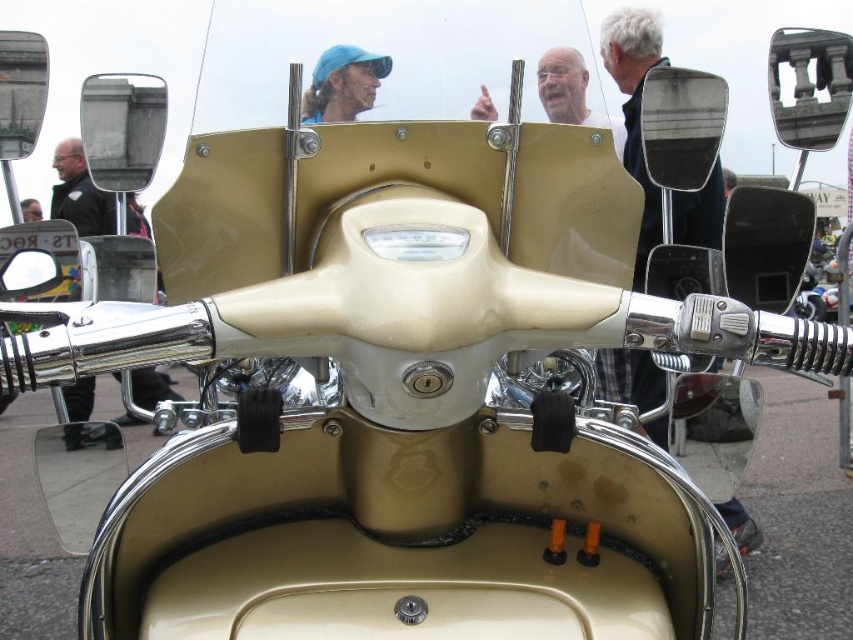
Who is lower down, gray hair at upper left or matte blue cap at upper center?

Positioned lower is matte blue cap at upper center.

This screenshot has height=640, width=853. I want to click on gray hair at upper left, so click(635, 109).

This screenshot has height=640, width=853. Identify the location of gray hair at upper left. click(635, 109).

Locate an element on the screen. The image size is (853, 640). smooth beige scooter at center is located at coordinates (572, 93).

Which of these two, smooth beige scooter at center or matte black helmet at upper left, stands taller?

smooth beige scooter at center is taller.

At what (x,y) coordinates should I click in order to perform the action: click on smooth beige scooter at center. Please return your answer as a coordinate pair (x, y). The width and height of the screenshot is (853, 640). Looking at the image, I should click on (572, 93).

Find the location of `smooth beige scooter at center`. smooth beige scooter at center is located at coordinates (572, 93).

Looking at this image, does matte blue cap at upper center have a lesser height compared to matte black helmet at upper left?

In fact, matte blue cap at upper center may be taller than matte black helmet at upper left.

Between matte blue cap at upper center and matte black helmet at upper left, which one has less height?

matte black helmet at upper left

Which is behind, point (329, 113) or point (28, 204)?

Positioned behind is point (28, 204).

Where is `matte blue cap at upper center`? This screenshot has height=640, width=853. matte blue cap at upper center is located at coordinates (343, 83).